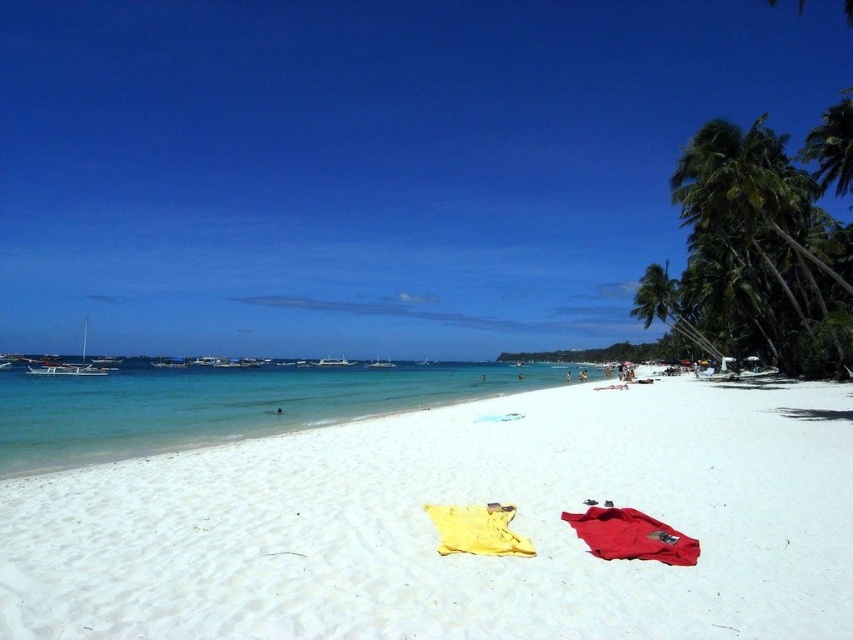
You are standing on the beach and see two points marked on the image. The first point is at coordinates point [282,429] and the second is at point [735,300]. Which point is closer to you?

Point [282,429] is in front of point [735,300], so the first point is closer to you.

You are a photographer setting up equipment on the beach. You have a matte red towel at lower right and a green leafy palm tree at right in your shot. Which object is taller in the photo?

The green leafy palm tree at right is taller than the matte red towel at lower right in the photo.